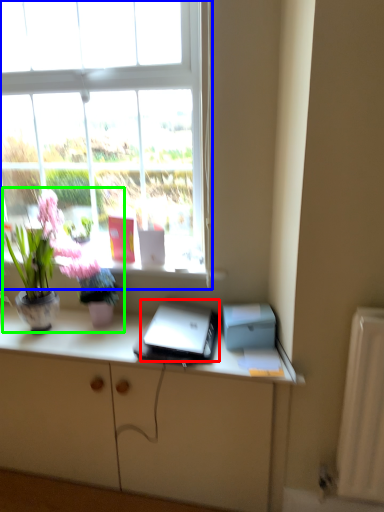
Question: Which is farther away from laptop (highlighted by a red box)? window (highlighted by a blue box) or houseplant (highlighted by a green box)?

Choices:
 (A) window
 (B) houseplant

Answer: (A)